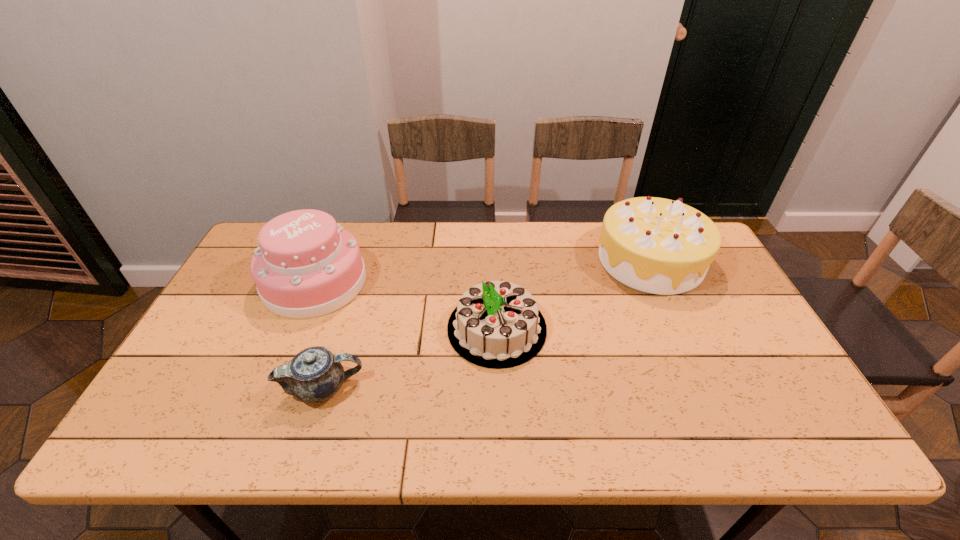
The height and width of the screenshot is (540, 960). Identify the location of vacant area in the image that satisfies the following two spatial constraints: 1. on the front side of the rightmost object; 2. from the spout of the chinaware. (708, 388).

The image size is (960, 540). In order to click on blank area in the image that satisfies the following two spatial constraints: 1. on the front side of the rightmost birthday cake; 2. from the spout of the chinaware in this screenshot , I will do `click(708, 388)`.

This screenshot has width=960, height=540. Identify the location of free location that satisfies the following two spatial constraints: 1. on the back side of the rightmost object; 2. on the right side of the second birthday cake from left to right. (494, 260).